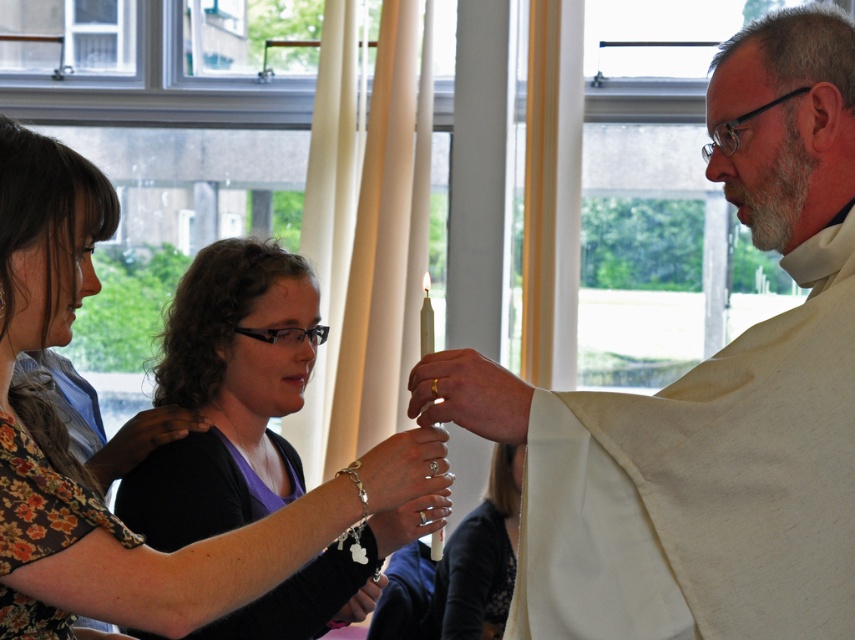
Question: Does white clothed man at center appear over silver metallic bracelet at lower center?

Choices:
 (A) yes
 (B) no

Answer: (A)

Question: Estimate the real-world distances between objects in this image. Which object is farther from the white clothed man at center?

Choices:
 (A) matte black shirt at center
 (B) silver metallic bracelet at lower center
 (C) white matte robe at center

Answer: (C)

Question: Can you confirm if matte black shirt at center is positioned to the right of silver metallic bracelet at lower center?

Choices:
 (A) yes
 (B) no

Answer: (B)

Question: Is white clothed man at center above matte black shirt at center?

Choices:
 (A) yes
 (B) no

Answer: (A)

Question: Among these objects, which one is farthest from the camera?

Choices:
 (A) white matte robe at center
 (B) matte black shirt at center

Answer: (A)

Question: Which point is farther to the camera?

Choices:
 (A) (476, 372)
 (B) (467, 524)
 (C) (62, 609)
 (D) (351, 564)

Answer: (B)